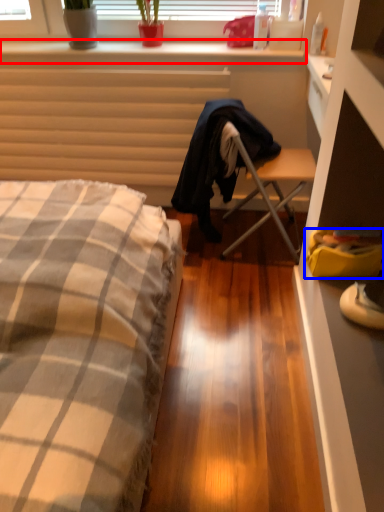
Question: Which object appears farthest to the camera in this image, window sill (highlighted by a red box) or handbag (highlighted by a blue box)?

Choices:
 (A) window sill
 (B) handbag

Answer: (A)